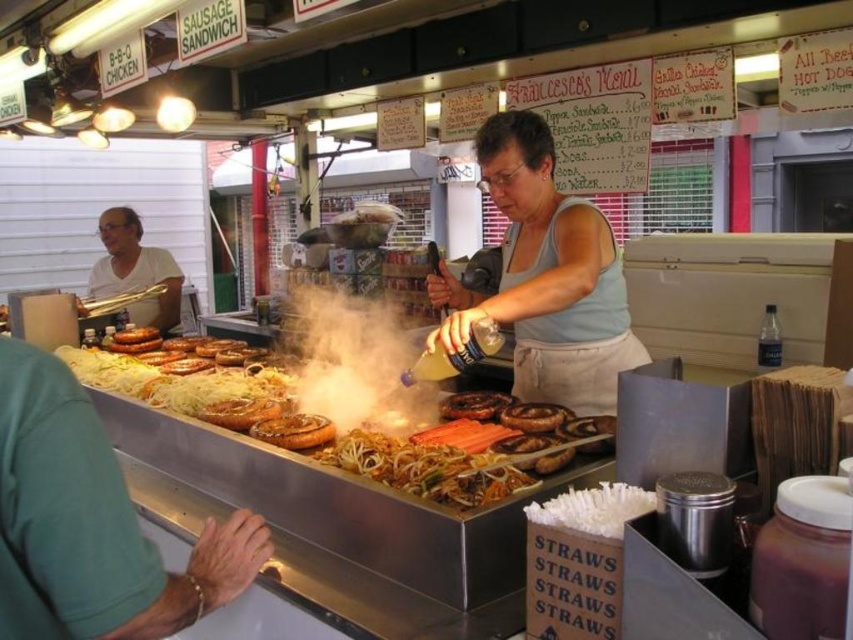
Question: Can you confirm if slightly browned wood sausages at center is thinner than slightly charred sausage at center?

Choices:
 (A) no
 (B) yes

Answer: (A)

Question: Considering the relative positions of slightly browned wood sausages at center and brown matte sausages at center in the image provided, where is slightly browned wood sausages at center located with respect to brown matte sausages at center?

Choices:
 (A) left
 (B) right

Answer: (A)

Question: Does slightly charred sausage at center appear on the right side of brown glazed pastry at center?

Choices:
 (A) yes
 (B) no

Answer: (B)

Question: Among these points, which one is nearest to the camera?

Choices:
 (A) coord(309,435)
 (B) coord(460,336)
 (C) coord(161,253)

Answer: (B)

Question: Among these objects, which one is farthest from the camera?

Choices:
 (A) slightly browned wood sausages at center
 (B) shiny brown noodles at center

Answer: (A)

Question: Which is farther from the white smoke at center?

Choices:
 (A) matte white shirt at left
 (B) slightly charred sausage at center

Answer: (A)